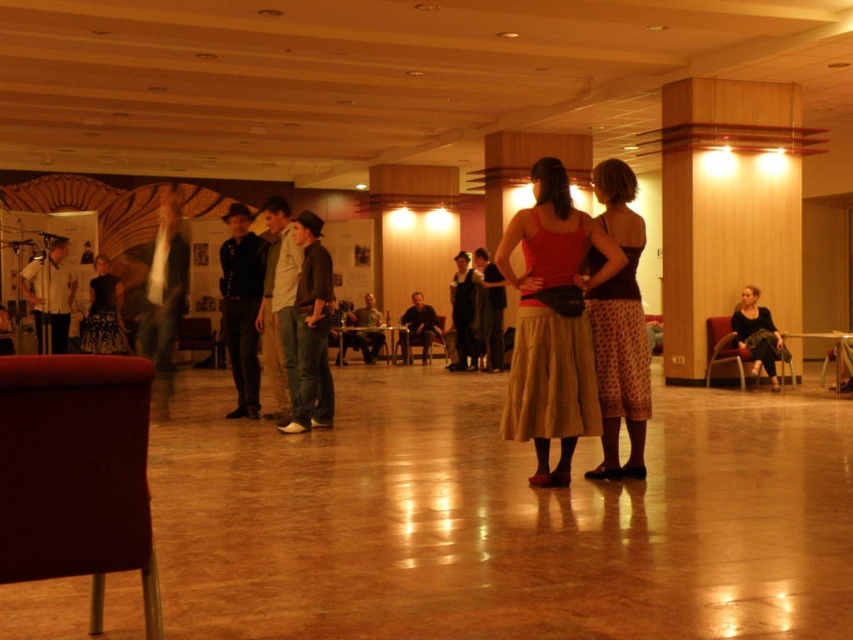
Question: Can you confirm if dark brown leather jacket at center is bigger than matte gray jacket at center?

Choices:
 (A) no
 (B) yes

Answer: (B)

Question: Which point appears closest to the camera in this image?

Choices:
 (A) coord(787,353)
 (B) coord(502,349)
 (C) coord(631,337)

Answer: (C)

Question: Is white shirt at left smaller than matte gray jacket at center?

Choices:
 (A) no
 (B) yes

Answer: (A)

Question: Which point is farther to the camera?

Choices:
 (A) matte gray jacket at center
 (B) dark brown leather jacket at lower right
 (C) dark brown leather jacket at center

Answer: (A)

Question: Is matte red tank top at center wider than white shirt at left?

Choices:
 (A) yes
 (B) no

Answer: (B)

Question: Which of the following is the closest to the observer?

Choices:
 (A) matte gray jacket at center
 (B) dark brown leather jacket at center
 (C) dark blue jeans at center
 (D) dark brown leather chair at center

Answer: (C)